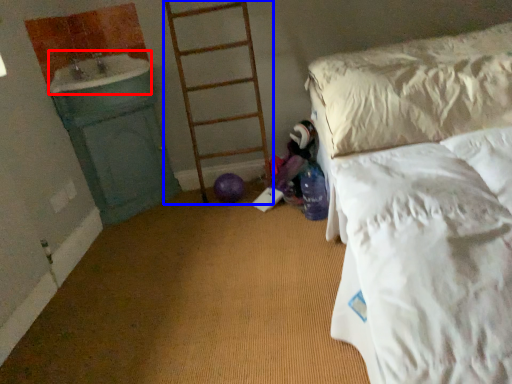
Question: Which of the following is the closest to the observer, sink (highlighted by a red box) or ladder (highlighted by a blue box)?

Choices:
 (A) sink
 (B) ladder

Answer: (A)